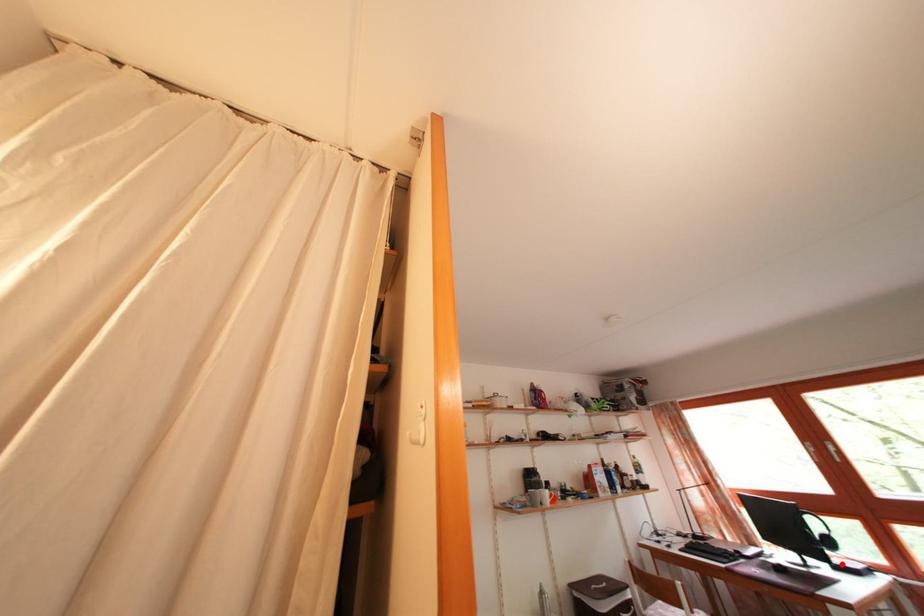
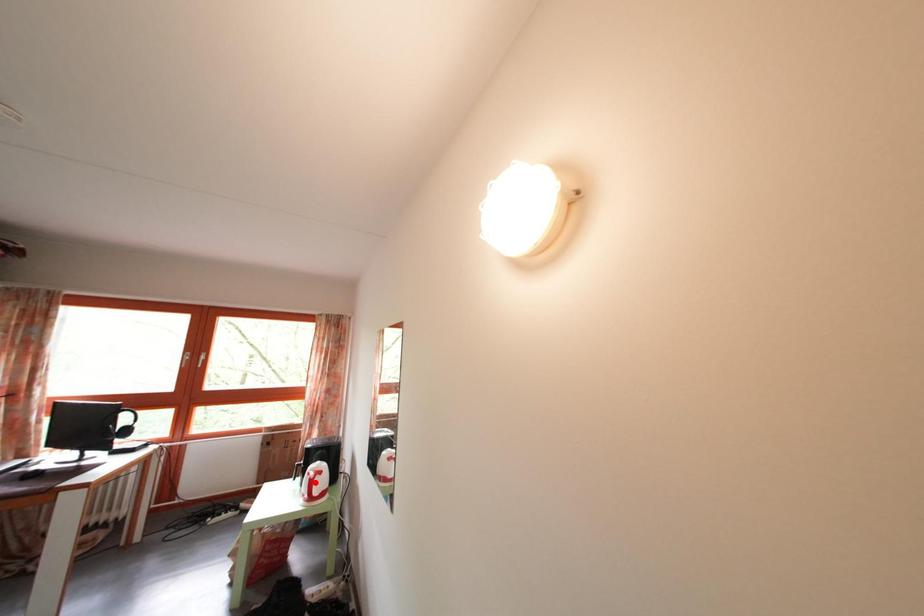
I am providing you with two images of the same scene from different viewpoints. A red point is marked on the first image and another point is marked on the second image. Is the marked point in image1 the same physical position as the marked point in image2?

No